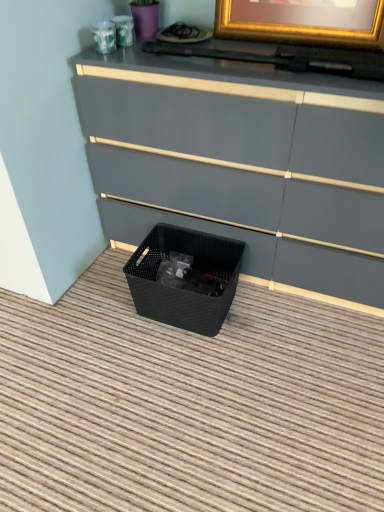
This screenshot has width=384, height=512. I want to click on vacant space to the right of black woven basket at lower center, so click(273, 316).